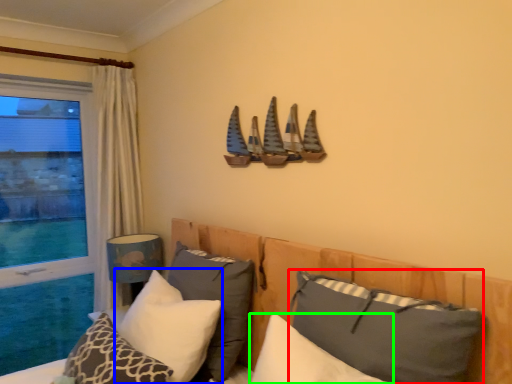
Question: Which object is positioned farthest from pillow (highlighted by a red box)? Select from pillow (highlighted by a blue box) and pillow (highlighted by a green box).

Choices:
 (A) pillow
 (B) pillow

Answer: (A)